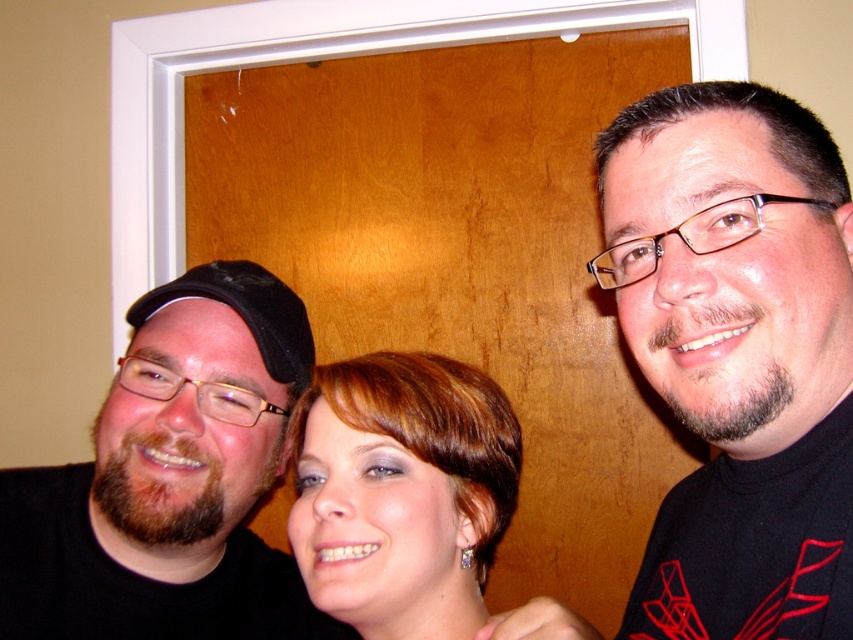
Question: Among these points, which one is nearest to the camera?

Choices:
 (A) (426, 502)
 (B) (300, 348)

Answer: (A)

Question: Is black matte t-shirt at right further to the viewer compared to shiny brown hair at center?

Choices:
 (A) yes
 (B) no

Answer: (B)

Question: In this image, where is matte black cap at left located relative to shiny brown hair at center?

Choices:
 (A) below
 (B) above

Answer: (A)

Question: Which is nearer to the shiny brown hair at center?

Choices:
 (A) black fabric baseball cap at left
 (B) matte black cap at left
 (C) black matte t-shirt at right

Answer: (A)

Question: Is shiny brown hair at center wider than black fabric baseball cap at left?

Choices:
 (A) yes
 (B) no

Answer: (A)

Question: Estimate the real-world distances between objects in this image. Which object is closer to the black matte t-shirt at right?

Choices:
 (A) matte black cap at left
 (B) shiny brown hair at center

Answer: (B)